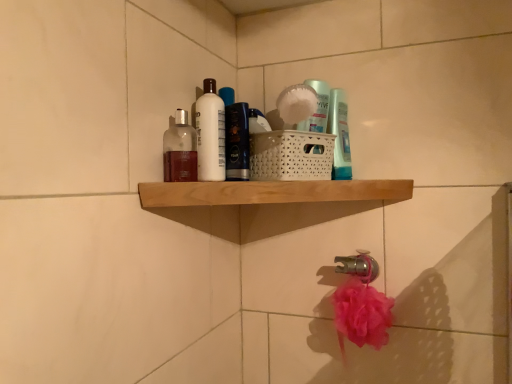
In order to click on silver metallic tap at lower center in this screenshot , I will do pos(358,266).

The height and width of the screenshot is (384, 512). Describe the element at coordinates (210, 133) in the screenshot. I see `white glossy bottle at upper center` at that location.

Image resolution: width=512 pixels, height=384 pixels. What do you see at coordinates (340, 135) in the screenshot?
I see `translucent plastic bottle at upper center, placed as the first toiletry when sorted from right to left` at bounding box center [340, 135].

Find the location of a particular element. This screenshot has width=512, height=384. silver metallic tap at lower center is located at coordinates (358, 266).

Who is shorter, translucent plastic bottle at upper center, which is the first toiletry from back to front, or translucent glass bottle at upper center, the first toiletry in the front-to-back sequence?

translucent glass bottle at upper center, the first toiletry in the front-to-back sequence, is shorter.

Considering the points (346, 101) and (164, 167), which point is in front, point (346, 101) or point (164, 167)?

Positioned in front is point (164, 167).

Is translucent plastic bottle at upper center, acting as the third toiletry starting from the left, not within translucent glass bottle at upper center, the 3th toiletry from the right?

translucent plastic bottle at upper center, acting as the third toiletry starting from the left, is positioned outside translucent glass bottle at upper center, the 3th toiletry from the right.

Considering the relative positions of translucent plastic bottle at upper center, acting as the third toiletry starting from the left, and translucent glass bottle at upper center, which is counted as the third toiletry, starting from the back, in the image provided, is translucent plastic bottle at upper center, acting as the third toiletry starting from the left, to the left of translucent glass bottle at upper center, which is counted as the third toiletry, starting from the back, from the viewer's perspective?

No, translucent plastic bottle at upper center, acting as the third toiletry starting from the left, is not to the left of translucent glass bottle at upper center, which is counted as the third toiletry, starting from the back.

Choose the correct answer: Is translucent glass bottle at upper center, which appears as the 1th toiletry when viewed from the left, inside wooden shelf at upper center or outside it?

translucent glass bottle at upper center, which appears as the 1th toiletry when viewed from the left, cannot be found inside wooden shelf at upper center.

Is point (174, 149) positioned in front of point (180, 202)?

No.

Based on their sizes in the image, would you say translucent glass bottle at upper center, which is counted as the third toiletry, starting from the back, is bigger or smaller than wooden shelf at upper center?

Clearly, translucent glass bottle at upper center, which is counted as the third toiletry, starting from the back, is smaller in size than wooden shelf at upper center.

From a real-world perspective, which is physically above, translucent glass bottle at upper center, which appears as the 1th toiletry when viewed from the left, or wooden shelf at upper center?

From a 3D spatial view, translucent glass bottle at upper center, which appears as the 1th toiletry when viewed from the left, is above.

Is the depth of wooden shelf at upper center greater than that of translucent plastic bottle at upper center, which is the first toiletry from back to front?

No, wooden shelf at upper center is in front of translucent plastic bottle at upper center, which is the first toiletry from back to front.

Between wooden shelf at upper center and translucent plastic bottle at upper center, which is the first toiletry from back to front, which one has less height?

wooden shelf at upper center is shorter.

Which object is thinner, wooden shelf at upper center or translucent plastic bottle at upper center, which is the first toiletry from back to front?

translucent plastic bottle at upper center, which is the first toiletry from back to front.

Is wooden shelf at upper center far away from translucent plastic bottle at upper center, which is the first toiletry from back to front?

No.

Considering the positions of objects translucent plastic bottle at upper center, which is the first toiletry from back to front, and wooden shelf at upper center in the image provided, who is more to the left, translucent plastic bottle at upper center, which is the first toiletry from back to front, or wooden shelf at upper center?

wooden shelf at upper center is more to the left.

Would you say wooden shelf at upper center is part of translucent plastic bottle at upper center, acting as the third toiletry starting from the left,'s contents?

No, wooden shelf at upper center is not inside translucent plastic bottle at upper center, acting as the third toiletry starting from the left.

Which point is more distant from viewer, [335,153] or [252,185]?

The point [335,153] is farther from the camera.

From a real-world perspective, is translucent plastic bottle at upper center, acting as the third toiletry starting from the left, positioned under wooden shelf at upper center based on gravity?

Incorrect, from a real-world perspective, translucent plastic bottle at upper center, acting as the third toiletry starting from the left, is higher than wooden shelf at upper center.

From a real-world perspective, does white glossy bottle at upper center stand above wooden shelf at upper center?

Yes, from a real-world perspective, white glossy bottle at upper center is above wooden shelf at upper center.

Would you say white glossy bottle at upper center contains wooden shelf at upper center?

That's incorrect, wooden shelf at upper center is not inside white glossy bottle at upper center.

Considering the sizes of objects white glossy bottle at upper center and wooden shelf at upper center in the image provided, who is wider, white glossy bottle at upper center or wooden shelf at upper center?

With larger width is wooden shelf at upper center.

Is there a large distance between white glossy bottle at upper center and silver metallic tap at lower center?

white glossy bottle at upper center is actually quite close to silver metallic tap at lower center.

Looking at this image, is white glossy bottle at upper center positioned with its back to silver metallic tap at lower center?

That's not correct — white glossy bottle at upper center is not looking away from silver metallic tap at lower center.

Is white glossy bottle at upper center at the right side of silver metallic tap at lower center?

In fact, white glossy bottle at upper center is to the left of silver metallic tap at lower center.

Is white glossy bottle at upper center wider than silver metallic tap at lower center?

No.

Considering the sizes of objects translucent plastic bottle at upper center, which is the first toiletry from back to front, and shiny black bottle at upper center, which is the second toiletry in front-to-back order, in the image provided, who is shorter, translucent plastic bottle at upper center, which is the first toiletry from back to front, or shiny black bottle at upper center, which is the second toiletry in front-to-back order,?

translucent plastic bottle at upper center, which is the first toiletry from back to front.

Does translucent plastic bottle at upper center, which is the first toiletry from back to front, have a greater width compared to shiny black bottle at upper center, which is the 2th toiletry in left-to-right order?

No, translucent plastic bottle at upper center, which is the first toiletry from back to front, is not wider than shiny black bottle at upper center, which is the 2th toiletry in left-to-right order.

From the image's perspective, is translucent plastic bottle at upper center, which is the first toiletry from back to front, above shiny black bottle at upper center, which is the second toiletry in front-to-back order?

No, from the image's perspective, translucent plastic bottle at upper center, which is the first toiletry from back to front, is not on top of shiny black bottle at upper center, which is the second toiletry in front-to-back order.

Is translucent plastic bottle at upper center, the 3th toiletry when ordered from front to back, directly adjacent to shiny black bottle at upper center, which is the 2th toiletry in left-to-right order?

No, translucent plastic bottle at upper center, the 3th toiletry when ordered from front to back, is not beside shiny black bottle at upper center, which is the 2th toiletry in left-to-right order.

From the translucent plastic bottle at upper center, which is the first toiletry from back to front, count 2nd toiletrys forward and point to it. Please provide its 2D coordinates.

[(180, 150)]

At what (x,y) coordinates should I click in order to perform the action: click on the 1st toiletry above the wooden shelf at upper center (from the image's perspective). Please return your answer as a coordinate pair (x, y). Looking at the image, I should click on (180, 150).

Looking at this image, which object lies nearer to the anchor point silver metallic tap at lower center, white glossy bottle at upper center or wooden shelf at upper center?

Among the two, wooden shelf at upper center is located nearer to silver metallic tap at lower center.

From the image, which object appears to be nearer to wooden shelf at upper center, translucent plastic bottle at upper center, which is the first toiletry from back to front, or silver metallic tap at lower center?

The object closer to wooden shelf at upper center is translucent plastic bottle at upper center, which is the first toiletry from back to front.

From the picture: Which object lies further to the anchor point wooden shelf at upper center, silver metallic tap at lower center or white glossy bottle at upper center?

silver metallic tap at lower center.

Which object lies nearer to the anchor point translucent glass bottle at upper center, the first toiletry in the front-to-back sequence, silver metallic tap at lower center or translucent plastic bottle at upper center, acting as the third toiletry starting from the left?

Based on the image, translucent plastic bottle at upper center, acting as the third toiletry starting from the left, appears to be nearer to translucent glass bottle at upper center, the first toiletry in the front-to-back sequence.

Based on their spatial positions, is translucent plastic bottle at upper center, acting as the third toiletry starting from the left, or wooden shelf at upper center closer to white glossy bottle at upper center?

wooden shelf at upper center lies closer to white glossy bottle at upper center than the other object.

When comparing their distances from shiny black bottle at upper center, the 2th toiletry viewed from the right, does white glossy bottle at upper center or wooden shelf at upper center seem further?

wooden shelf at upper center is further to shiny black bottle at upper center, the 2th toiletry viewed from the right.

Based on their spatial positions, is wooden shelf at upper center or silver metallic tap at lower center closer to white glossy bottle at upper center?

wooden shelf at upper center lies closer to white glossy bottle at upper center than the other object.

From the picture: From the image, which object appears to be nearer to silver metallic tap at lower center, shiny black bottle at upper center, which is the 2th toiletry in left-to-right order, or wooden shelf at upper center?

wooden shelf at upper center.

At what (x,y) coordinates should I click in order to perform the action: click on toiletry between translucent glass bottle at upper center, the first toiletry in the front-to-back sequence, and translucent plastic bottle at upper center, acting as the third toiletry starting from the left, in the horizontal direction. Please return your answer as a coordinate pair (x, y). The height and width of the screenshot is (384, 512). Looking at the image, I should click on coord(237,141).

Find the location of a particular element. toiletry between wooden shelf at upper center and shiny black bottle at upper center, which is the 2th toiletry in left-to-right order, in the front-back direction is located at coordinates (180, 150).

Where is `cleaning product positioned between wooden shelf at upper center and translucent plastic bottle at upper center, placed as the first toiletry when sorted from right to left, from near to far`? cleaning product positioned between wooden shelf at upper center and translucent plastic bottle at upper center, placed as the first toiletry when sorted from right to left, from near to far is located at coordinates (210, 133).

The image size is (512, 384). Identify the location of cleaning product between wooden shelf at upper center and silver metallic tap at lower center in the front-back direction. (210, 133).